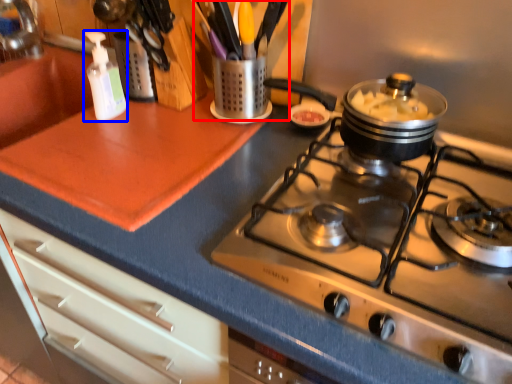
Question: Which object is closer to the camera taking this photo, appliance (highlighted by a red box) or bottle (highlighted by a blue box)?

Choices:
 (A) appliance
 (B) bottle

Answer: (B)